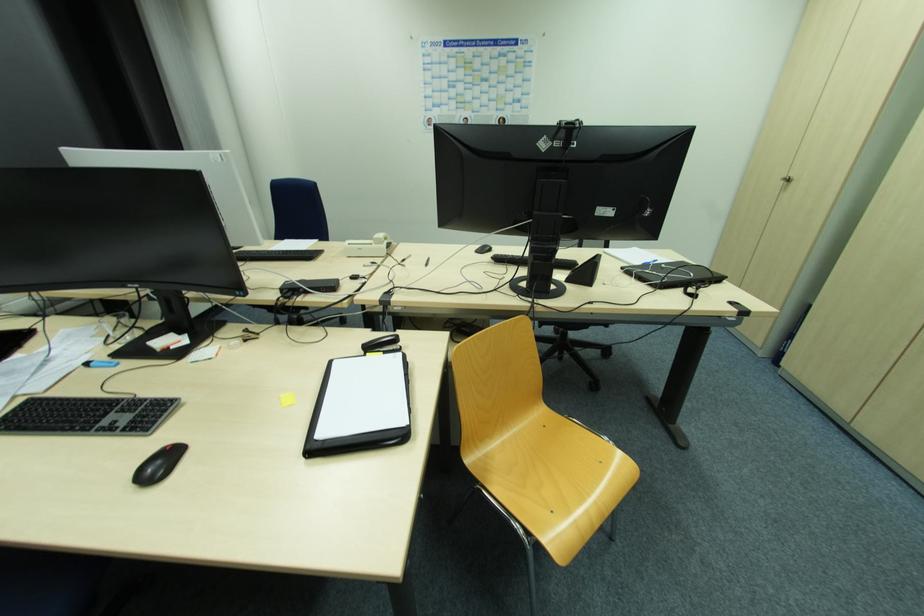
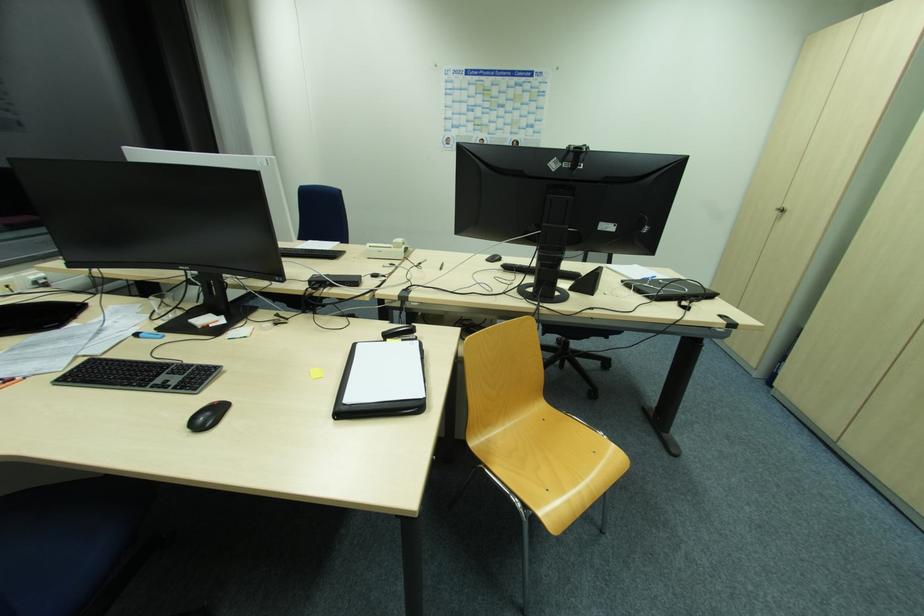
Where in the second image is the point corresponding to (x=161, y=463) from the first image?

(211, 415)